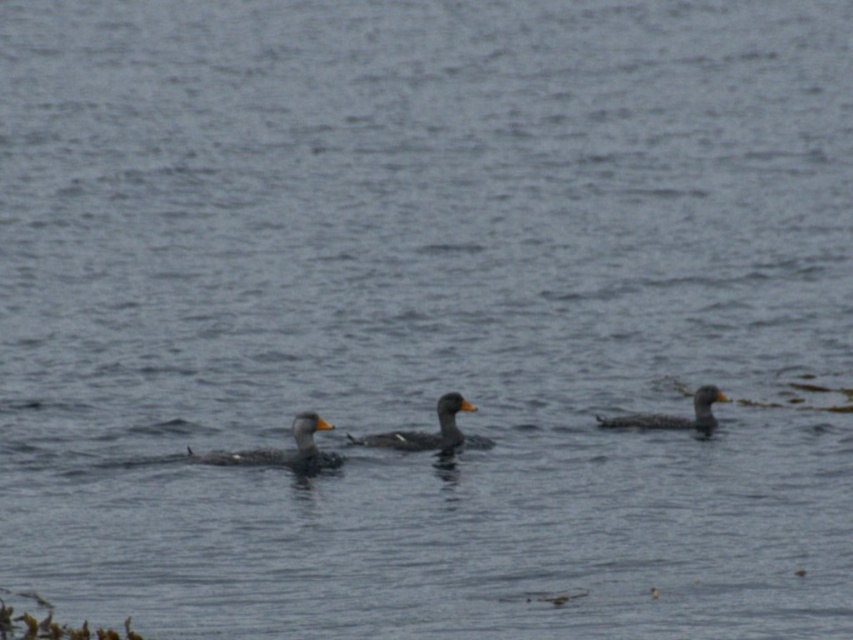
You are a photographer trying to capture the two ducks in the water. You want to take a photo where the gray matte duck at center is to the left of the speckled gray duck at right. Can you confirm if this arrangement is possible based on their current positions?

Yes, the gray matte duck at center is already positioned on the left side of the speckled gray duck at right, so this arrangement is possible.

You are a birdwatcher observing the three ducks in the water. You notice that two of them, the speckled gray duck at center and the speckled gray duck at right, are positioned in a specific way. From your viewpoint, which duck is positioned lower in the image?

The speckled gray duck at center is located below the speckled gray duck at right, so it is positioned lower in the image.